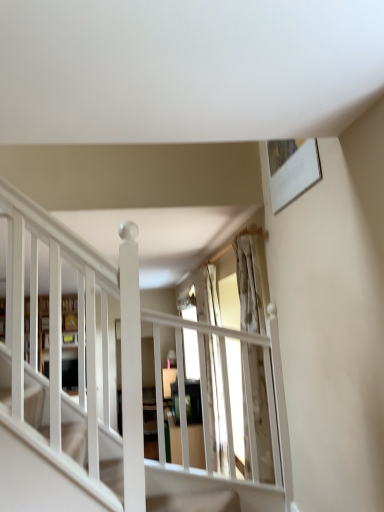
Question: Based on their positions, is translucent glass window at center located to the left or right of wooden bookshelf at left?

Choices:
 (A) left
 (B) right

Answer: (B)

Question: From a real-world perspective, is translucent glass window at center above or below wooden bookshelf at left?

Choices:
 (A) below
 (B) above

Answer: (A)

Question: Which object is positioned farthest from the white wooden shelf at left?

Choices:
 (A) wooden bookshelf at left
 (B) translucent glass window at center

Answer: (B)

Question: Which object is positioned farthest from the translucent glass window at center?

Choices:
 (A) white wooden shelf at left
 (B) wooden bookshelf at left

Answer: (A)